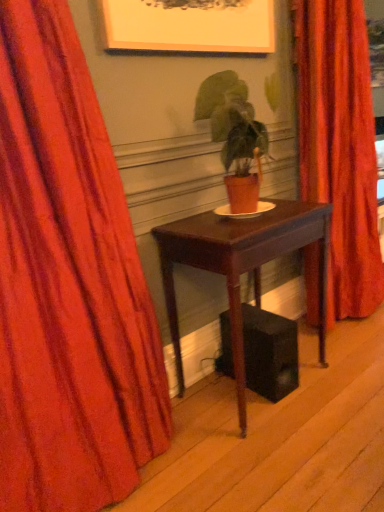
Locate an element on the screen. vacant point above mahogany wood table at center (from a real-world perspective) is located at coordinates (241, 221).